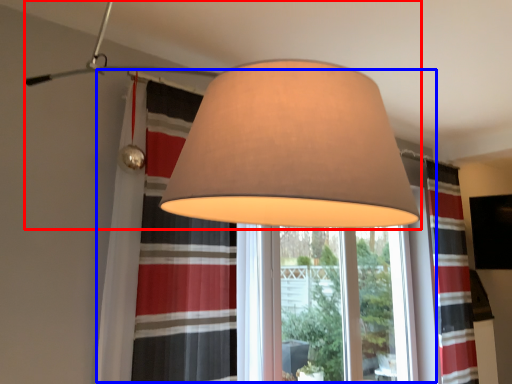
Question: Which object is closer to the camera taking this photo, lamp (highlighted by a red box) or bay window (highlighted by a blue box)?

Choices:
 (A) lamp
 (B) bay window

Answer: (A)